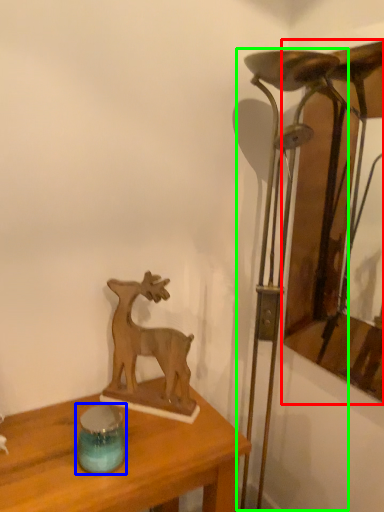
Question: Estimate the real-world distances between objects in this image. Which object is farther from picture frame (highlighted by a red box), candle holder (highlighted by a blue box) or table lamp (highlighted by a green box)?

Choices:
 (A) candle holder
 (B) table lamp

Answer: (A)